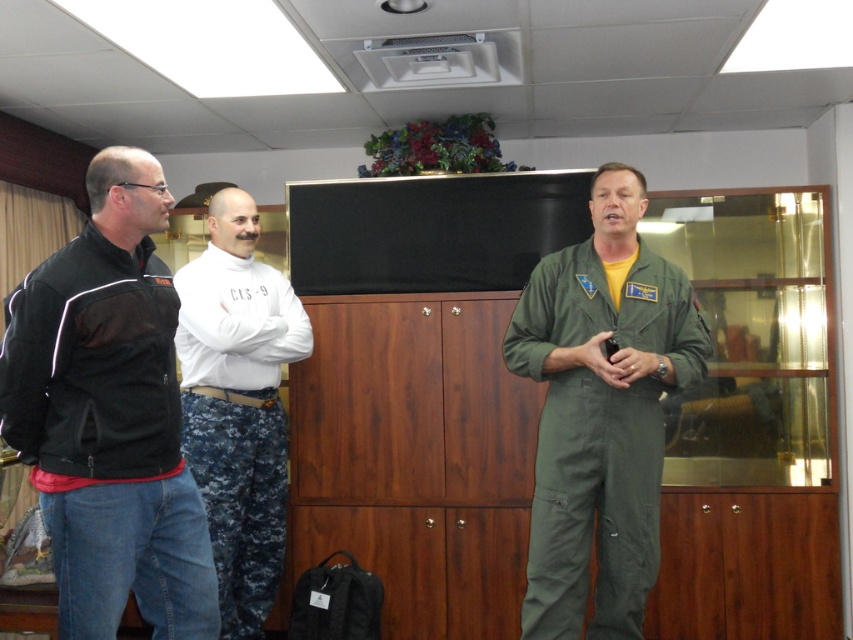
You are an observer in the room. You see the green fabric jumpsuit at center and the white cotton shirt at center. Which one has a shorter vertical length?

The green fabric jumpsuit at center has a lesser height compared to the white cotton shirt at center, so the green fabric jumpsuit at center is shorter vertically.

You are a delivery person trying to place a small package between the wooden cabinet at center and the white cotton shirt at center. Can you fit the package if it measures 45 centimeters in width?

The wooden cabinet at center and white cotton shirt at center are 47.54 centimeters apart. Since the package is 45 centimeters wide, it should fit with some space to spare.